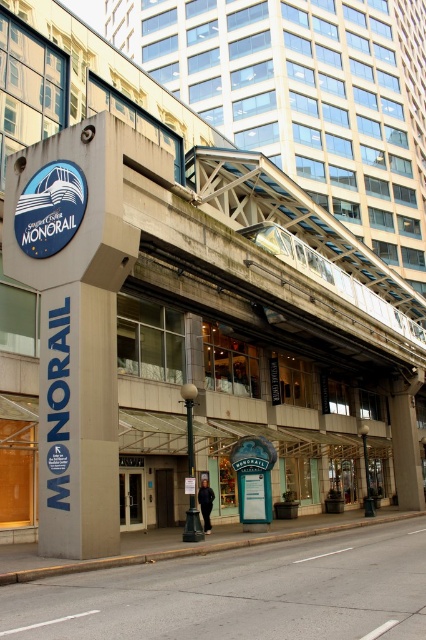
You are a maintenance worker needing to inspect both the gray concrete sign at left and the blue glossy monorail sign at upper left. Given that your ladder can only reach objects within 1 meter, can you safely inspect both signs without moving the ladder?

The distance between the gray concrete sign at left and the blue glossy monorail sign at upper left is 92.34 centimeters, which is within the 1 meter reach of your ladder. Therefore, you can safely inspect both signs without moving the ladder.

Consider the image. You are a tourist standing at the monorail station entrance. You want to take a photo of the gray concrete sign at left and the blue glossy monorail sign at upper left. Which sign should you look up towards to capture both in the frame?

You should look up towards the blue glossy monorail sign at upper left because the gray concrete sign at left is below it, so both can be captured in the frame by aiming upwards.

You are a tourist holding a map and looking at the gray concrete sign at left and the blue glossy monorail sign at upper left. Which sign is bigger?

The gray concrete sign at left is larger in size compared to the blue glossy monorail sign at upper left.